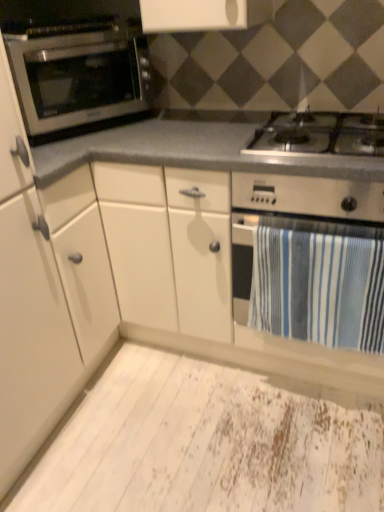
You are a GUI agent. You are given a task and a screenshot of the screen. Output one action in this format:
    pyautogui.click(x=<x>, y=<y>)
    Task: Click on the vacant area located to the right-hand side of satin silver oven at left
    Image resolution: width=384 pixels, height=512 pixels.
    Given the screenshot: What is the action you would take?
    pyautogui.click(x=189, y=127)